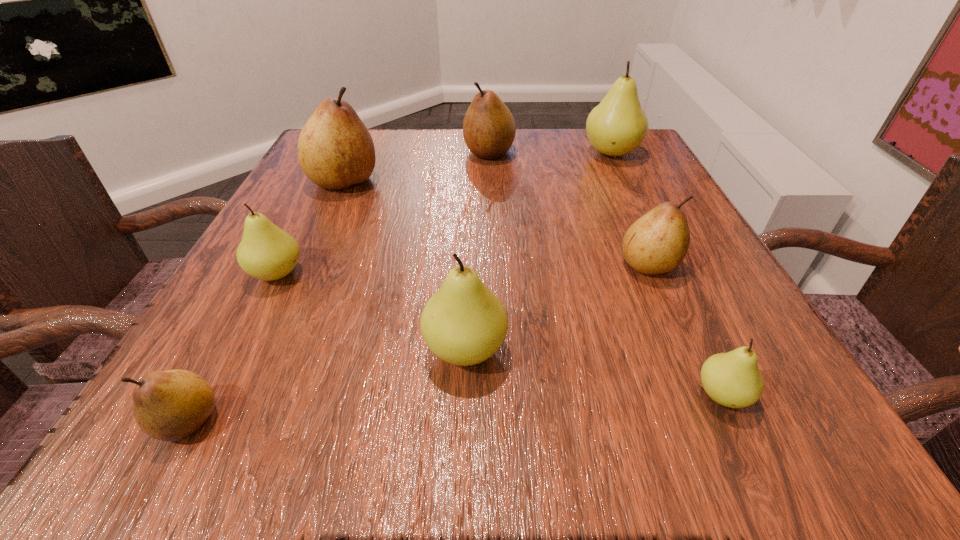
At what (x,y) coordinates should I click in order to perform the action: click on vacant space located 0.150m on the front of the farthest green pear. Please return your answer as a coordinate pair (x, y). The width and height of the screenshot is (960, 540). Looking at the image, I should click on (636, 204).

The height and width of the screenshot is (540, 960). I want to click on vacant region located 0.100m on the back of the biggest brown pear, so click(360, 145).

Locate an element on the screen. blank space located on the front of the second brown pear from right to left is located at coordinates click(x=492, y=230).

The width and height of the screenshot is (960, 540). Identify the location of free point located 0.350m on the back of the third smallest green pear. (470, 191).

This screenshot has height=540, width=960. Identify the location of free space located on the back of the rightmost brown pear. (610, 174).

What are the coordinates of `vacant region located on the back of the second farthest green pear` in the screenshot? It's located at (320, 191).

Where is `vacant space located on the left of the smallest green pear`? This screenshot has width=960, height=540. vacant space located on the left of the smallest green pear is located at coordinates (637, 395).

The height and width of the screenshot is (540, 960). Find the location of `vacant space located 0.090m on the back of the nearest brown pear`. vacant space located 0.090m on the back of the nearest brown pear is located at coordinates (233, 336).

Where is `object situated at the far left corner`? object situated at the far left corner is located at coordinates (335, 150).

This screenshot has height=540, width=960. I want to click on object positioned at the near left corner, so click(x=170, y=405).